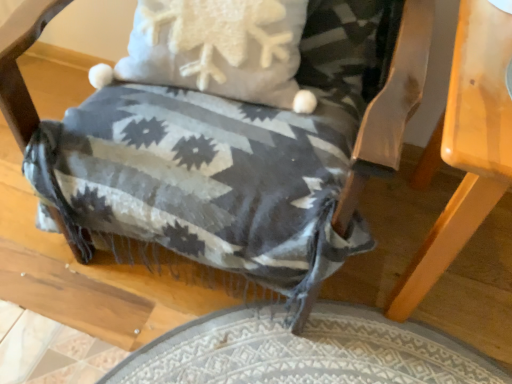
Question: Is light brown wooden table at lower right taller or shorter than woven fabric blanket at center?

Choices:
 (A) short
 (B) tall

Answer: (A)

Question: From the image's perspective, relative to woven fabric blanket at center, is light brown wooden table at lower right above or below?

Choices:
 (A) below
 (B) above

Answer: (A)

Question: From a real-world perspective, is light brown wooden table at lower right physically located above or below woven fabric blanket at center?

Choices:
 (A) below
 (B) above

Answer: (A)

Question: From a real-world perspective, is woven fabric blanket at center above or below light brown wooden table at lower right?

Choices:
 (A) below
 (B) above

Answer: (B)

Question: From the image's perspective, is woven fabric blanket at center positioned above or below light brown wooden table at lower right?

Choices:
 (A) above
 (B) below

Answer: (A)

Question: In terms of size, does woven fabric blanket at center appear bigger or smaller than light brown wooden table at lower right?

Choices:
 (A) big
 (B) small

Answer: (A)

Question: Is woven fabric blanket at center wider or thinner than light brown wooden table at lower right?

Choices:
 (A) wide
 (B) thin

Answer: (A)